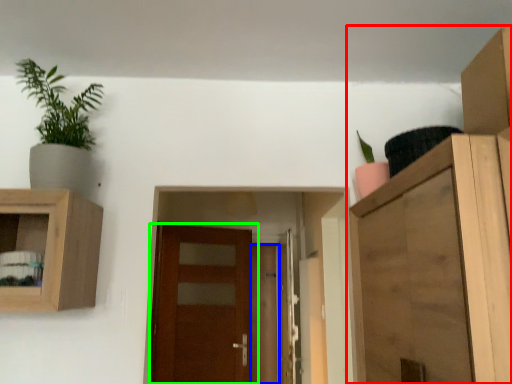
Question: Which is farther away from cupboard (highlighted by a red box)? door (highlighted by a blue box) or door (highlighted by a green box)?

Choices:
 (A) door
 (B) door

Answer: (A)